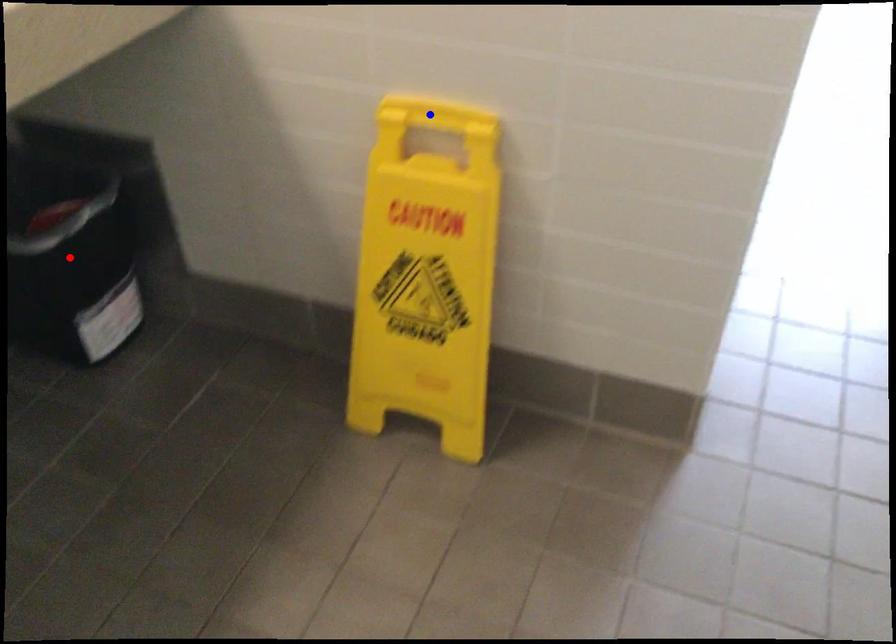
Question: Which of the two points in the image is closer to the camera?

Choices:
 (A) Blue point is closer.
 (B) Red point is closer.

Answer: (A)